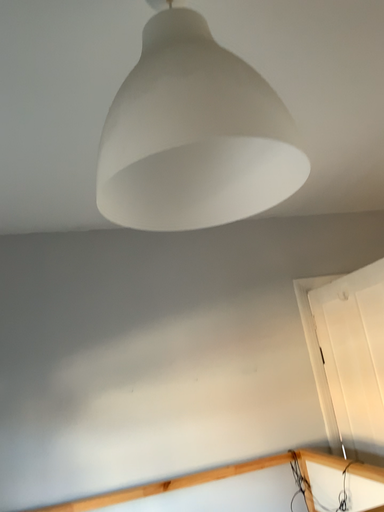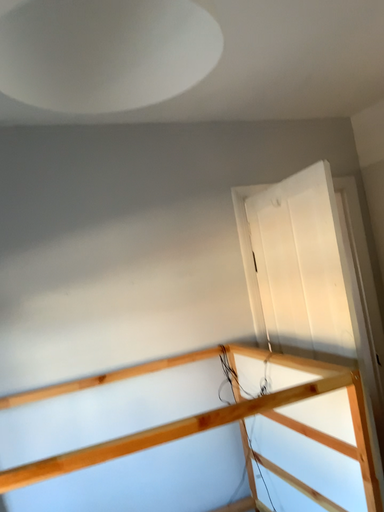
Question: How did the camera likely rotate when shooting the video?

Choices:
 (A) rotated right
 (B) rotated left

Answer: (A)